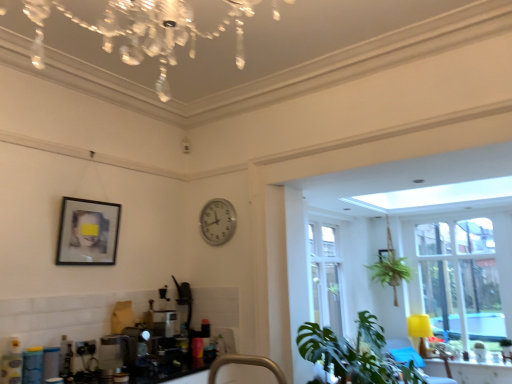
Question: From the image's perspective, would you say clear glass window at right is positioned over velvet yellow armchair at lower right?

Choices:
 (A) no
 (B) yes

Answer: (B)

Question: Is clear glass window at right positioned in front of velvet yellow armchair at lower right?

Choices:
 (A) yes
 (B) no

Answer: (B)

Question: Does clear glass window at right turn towards velvet yellow armchair at lower right?

Choices:
 (A) yes
 (B) no

Answer: (A)

Question: From the image's perspective, is clear glass window at right located beneath velvet yellow armchair at lower right?

Choices:
 (A) no
 (B) yes

Answer: (A)

Question: From a real-world perspective, is clear glass window at right on velvet yellow armchair at lower right?

Choices:
 (A) no
 (B) yes

Answer: (B)

Question: Can you confirm if clear glass window at right is wider than velvet yellow armchair at lower right?

Choices:
 (A) yes
 (B) no

Answer: (B)

Question: Considering the relative sizes of velvet yellow armchair at lower right and matte black picture frame at upper left, the 2th picture frame positioned from the bottom, in the image provided, is velvet yellow armchair at lower right wider than matte black picture frame at upper left, the 2th picture frame positioned from the bottom,?

Choices:
 (A) yes
 (B) no

Answer: (A)

Question: From the image's perspective, is velvet yellow armchair at lower right located above matte black picture frame at upper left, the 2th picture frame positioned from the bottom?

Choices:
 (A) yes
 (B) no

Answer: (B)

Question: Is velvet yellow armchair at lower right further to camera compared to matte black picture frame at upper left, acting as the 2th picture frame starting from the right?

Choices:
 (A) yes
 (B) no

Answer: (A)

Question: From the image's perspective, is velvet yellow armchair at lower right below matte black picture frame at upper left, acting as the 2th picture frame starting from the right?

Choices:
 (A) yes
 (B) no

Answer: (A)

Question: Is matte black picture frame at upper left, the first picture frame in the top-to-bottom sequence, at the back of velvet yellow armchair at lower right?

Choices:
 (A) no
 (B) yes

Answer: (A)

Question: Is velvet yellow armchair at lower right positioned before matte black picture frame at upper left, which is counted as the first picture frame, starting from the left?

Choices:
 (A) yes
 (B) no

Answer: (B)

Question: Does clear glass window at right have a greater width compared to matte black picture frame at upper right, the 2th picture frame viewed from the left?

Choices:
 (A) yes
 (B) no

Answer: (A)